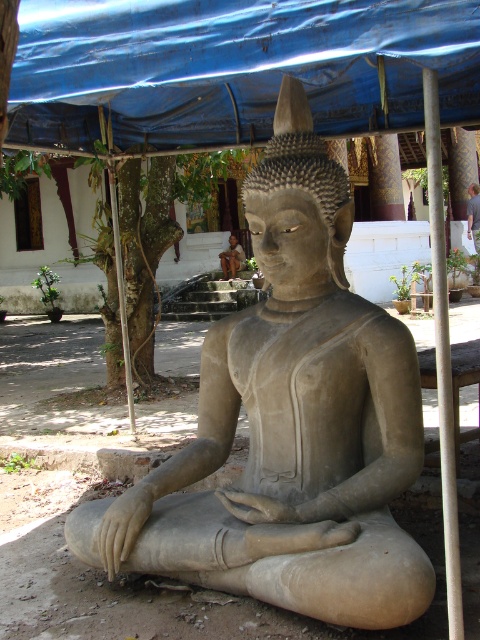
You are standing in front of the seated Buddha statue and want to locate the white smooth pole at right. Where would you look relative to the statue?

The white smooth pole at right is located at the 2D coordinate point of 0.555 on the x axis and 0.923 on the y axis relative to the statue.

You are a painter standing at the base of the steps where the person is sitting. You want to paint both the white smooth pole at right and the metallic pole at left. Which pole should you look upwards to paint?

The white smooth pole at right is located above the metallic pole at left, so to paint the white smooth pole at right, you should look upwards from the metallic pole at left.